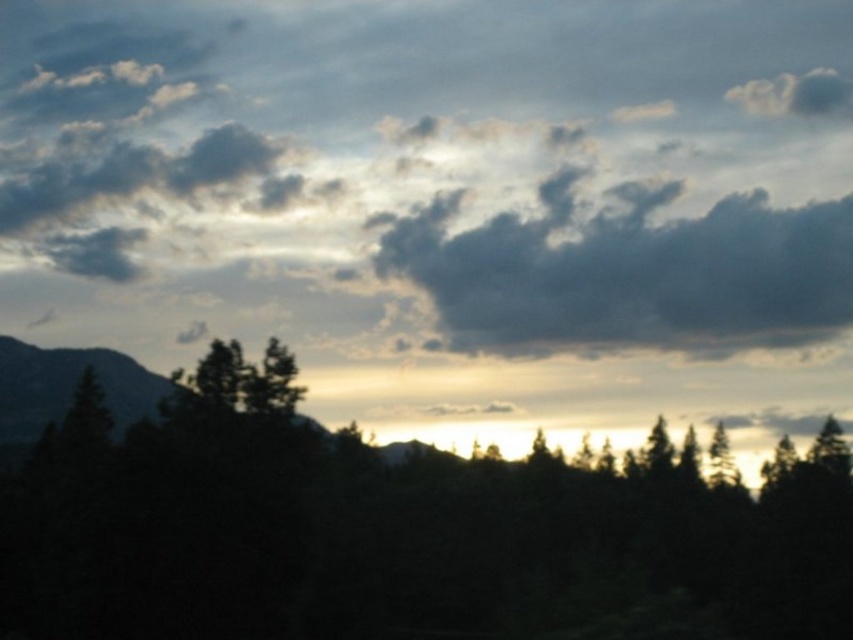
Who is more distant from viewer, (277,612) or (502,275)?

The point (502,275) is behind.

Who is positioned more to the left, dark green foliage at center or dark gray fluffy cloud at upper center?

From the viewer's perspective, dark green foliage at center appears more on the left side.

Where is `dark green foliage at center`? The image size is (853, 640). dark green foliage at center is located at coordinates (376, 524).

Is point (444, 268) in front of point (16, 438)?

That is False.

Is dark gray fluffy cloud at upper center in front of dark gray rocky mountain at left?

No, it is not.

This screenshot has width=853, height=640. I want to click on dark gray fluffy cloud at upper center, so click(x=627, y=273).

Is dark green foliage at center taller than dark gray rocky mountain at left?

Correct, dark green foliage at center is much taller as dark gray rocky mountain at left.

Does point (209, 412) lie behind point (10, 412)?

No, it is not.

This screenshot has width=853, height=640. Identify the location of dark green foliage at center. (376, 524).

Locate an element on the screen. The height and width of the screenshot is (640, 853). dark green foliage at center is located at coordinates (376, 524).